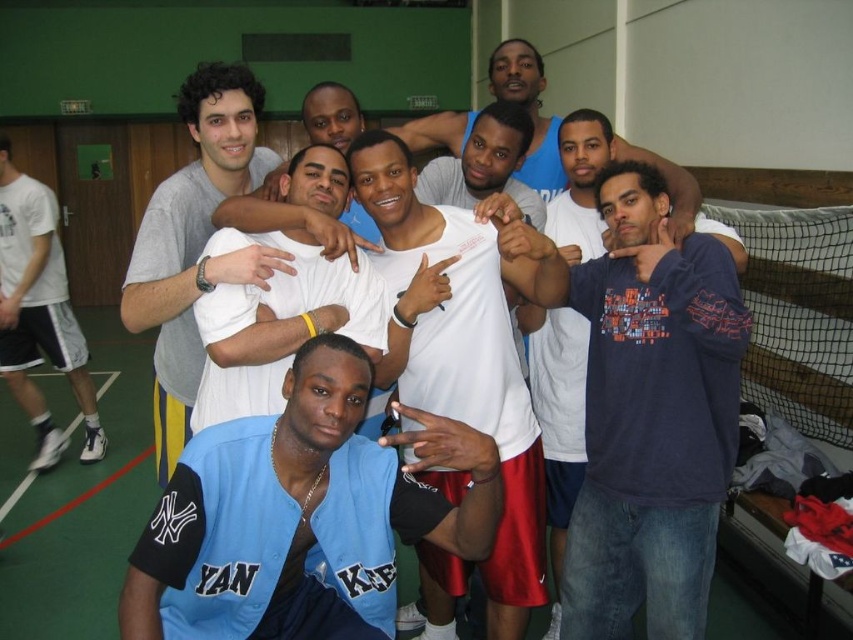
Does point (171, 292) come closer to viewer compared to point (314, 321)?

Yes.

Can you confirm if white matte t-shirt at center is positioned below white matte shirt at center?

Incorrect, white matte t-shirt at center is not positioned below white matte shirt at center.

Locate an element on the screen. white matte t-shirt at center is located at coordinates (206, 237).

Is point (738, 291) positioned before point (474, 305)?

Yes, point (738, 291) is in front of point (474, 305).

Measure the distance between point [605,576] and camera.

They are 2.01 meters apart.

Measure the distance between dark blue cotton shirt at center and camera.

dark blue cotton shirt at center is 1.62 meters from camera.

Where is `dark blue cotton shirt at center`? The width and height of the screenshot is (853, 640). dark blue cotton shirt at center is located at coordinates (651, 417).

Does point (161, 186) lie in front of point (282, 308)?

No, (161, 186) is behind (282, 308).

Is matte gray t-shirt at upper left in front of white matte shirt at center?

That is True.

This screenshot has height=640, width=853. What do you see at coordinates (195, 241) in the screenshot?
I see `matte gray t-shirt at upper left` at bounding box center [195, 241].

Find the location of a particular element. This screenshot has height=640, width=853. matte gray t-shirt at upper left is located at coordinates (195, 241).